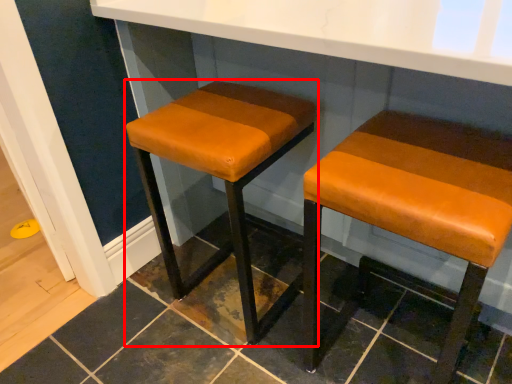
Question: Where is stool (annotated by the red box) located in relation to stool in the image?

Choices:
 (A) right
 (B) left

Answer: (B)